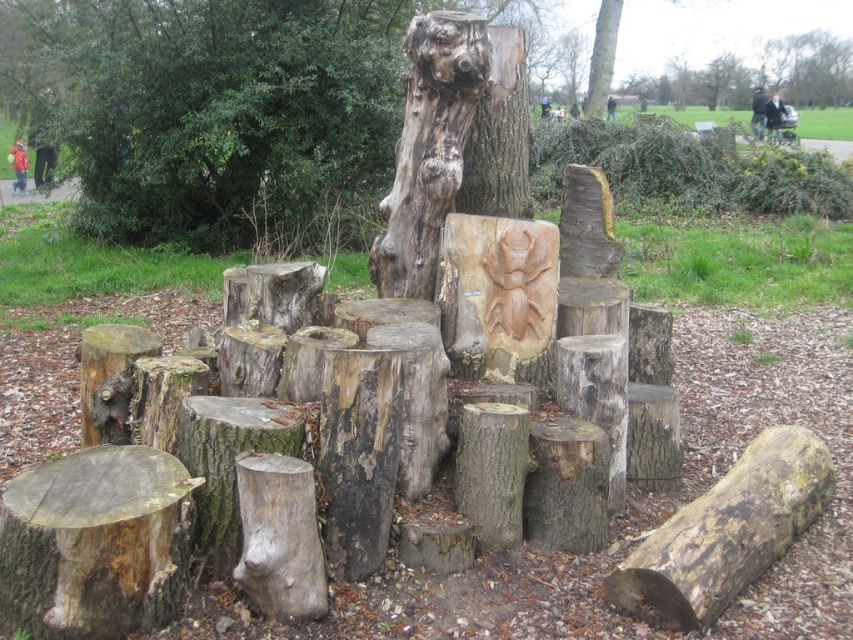
You are planning to sit on the smooth wooden bench at upper center but want to know if it can support your weight. Considering the brown rough tree trunk at upper center is known to hold 100 kg, what is the minimum weight capacity you should assume for the bench?

The smooth wooden bench at upper center is bigger than the brown rough tree trunk at upper center. Since the tree trunk can hold 100 kg, the bench, being larger, likely has a higher capacity. Assume it can support at least 100 kg.

You are a visitor standing at the entrance of the park, looking at the natural wood tree stump at center and the brown rough tree trunk at upper center. Which object is closer to you?

The natural wood tree stump at center is closer to you because it is in front of the brown rough tree trunk at upper center.